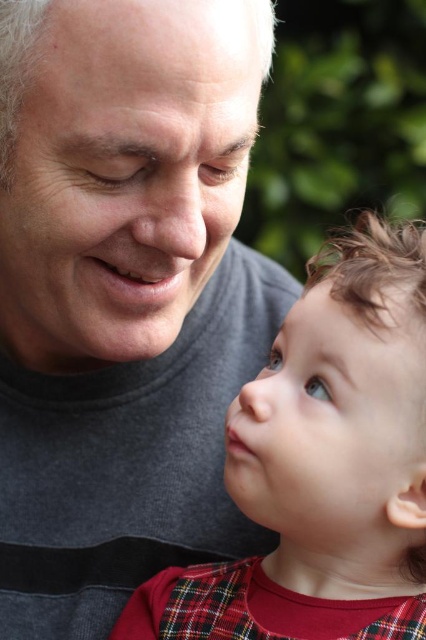
Question: Among these objects, which one is nearest to the camera?

Choices:
 (A) smooth skin nose at center
 (B) gray cotton t-shirt at upper left
 (C) plaid fabric baby at center

Answer: (B)

Question: Does plaid fabric baby at center have a smaller size compared to smooth white forehead at upper center?

Choices:
 (A) yes
 (B) no

Answer: (B)

Question: Does plaid fabric baby at center lie in front of smooth white forehead at upper center?

Choices:
 (A) yes
 (B) no

Answer: (B)

Question: Estimate the real-world distances between objects in this image. Which object is closer to the gray cotton t-shirt at upper left?

Choices:
 (A) plaid fabric baby at center
 (B) matte gray face at upper left
 (C) smooth skin baby at center
 (D) smooth white forehead at upper center

Answer: (B)

Question: Which object is positioned farthest from the plaid fabric baby at center?

Choices:
 (A) smooth skin nose at center
 (B) matte gray face at upper left
 (C) smooth skin baby at center

Answer: (B)

Question: In this image, where is matte gray face at upper left located relative to smooth skin baby at center?

Choices:
 (A) left
 (B) right

Answer: (A)